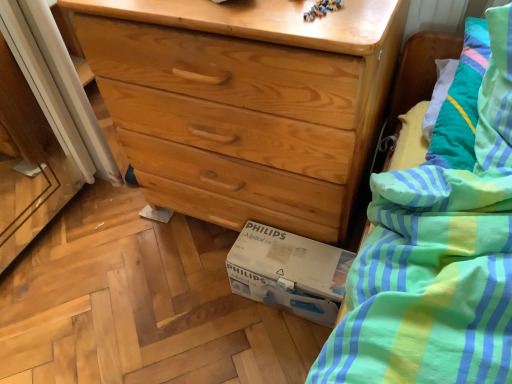
Question: From their relative heights in the image, would you say natural wood chest of drawers at center is taller or shorter than white cardboard box at lower center?

Choices:
 (A) tall
 (B) short

Answer: (A)

Question: Does point (224, 44) appear closer or farther from the camera than point (297, 253)?

Choices:
 (A) farther
 (B) closer

Answer: (B)

Question: From the image's perspective, is natural wood chest of drawers at center above or below white cardboard box at lower center?

Choices:
 (A) below
 (B) above

Answer: (B)

Question: From the image's perspective, is white cardboard box at lower center positioned above or below natural wood chest of drawers at center?

Choices:
 (A) below
 (B) above

Answer: (A)

Question: Based on their sizes in the image, would you say white cardboard box at lower center is bigger or smaller than natural wood chest of drawers at center?

Choices:
 (A) big
 (B) small

Answer: (B)

Question: From a real-world perspective, relative to natural wood chest of drawers at center, is white cardboard box at lower center vertically above or below?

Choices:
 (A) above
 (B) below

Answer: (B)

Question: Do you think white cardboard box at lower center is within natural wood chest of drawers at center, or outside of it?

Choices:
 (A) outside
 (B) inside

Answer: (A)